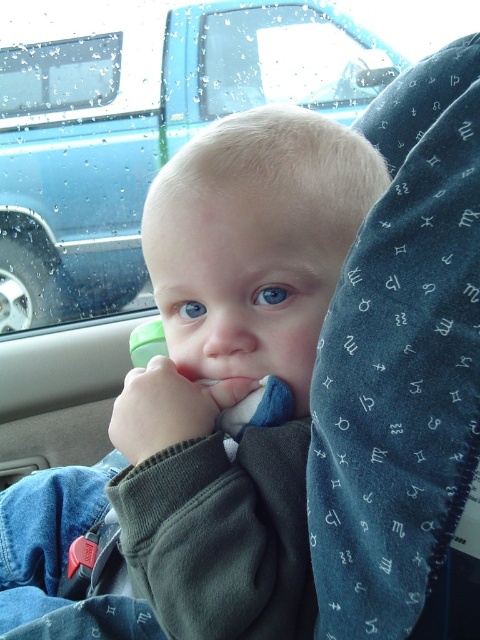
Does transparent glass window at upper center lie behind transparent glass window at upper left?

Yes, transparent glass window at upper center is further from the viewer.

This screenshot has height=640, width=480. Describe the element at coordinates (289, 60) in the screenshot. I see `transparent glass window at upper center` at that location.

Is point (228, 77) behind point (61, 44)?

Yes, point (228, 77) is farther from viewer.

Locate an element on the screen. transparent glass window at upper center is located at coordinates (289, 60).

Between smooth green sippy cup at center and transparent glass window at upper center, which one is positioned higher?

transparent glass window at upper center is higher up.

This screenshot has height=640, width=480. What are the coordinates of `smooth green sippy cup at center` in the screenshot? It's located at 206,401.

Can you confirm if smooth green sippy cup at center is bigger than blue fabric car at upper center?

No.

Is smooth green sippy cup at center positioned behind blue fabric car at upper center?

No.

The height and width of the screenshot is (640, 480). What do you see at coordinates (206, 401) in the screenshot?
I see `smooth green sippy cup at center` at bounding box center [206, 401].

What are the coordinates of `smooth green sippy cup at center` in the screenshot? It's located at (206, 401).